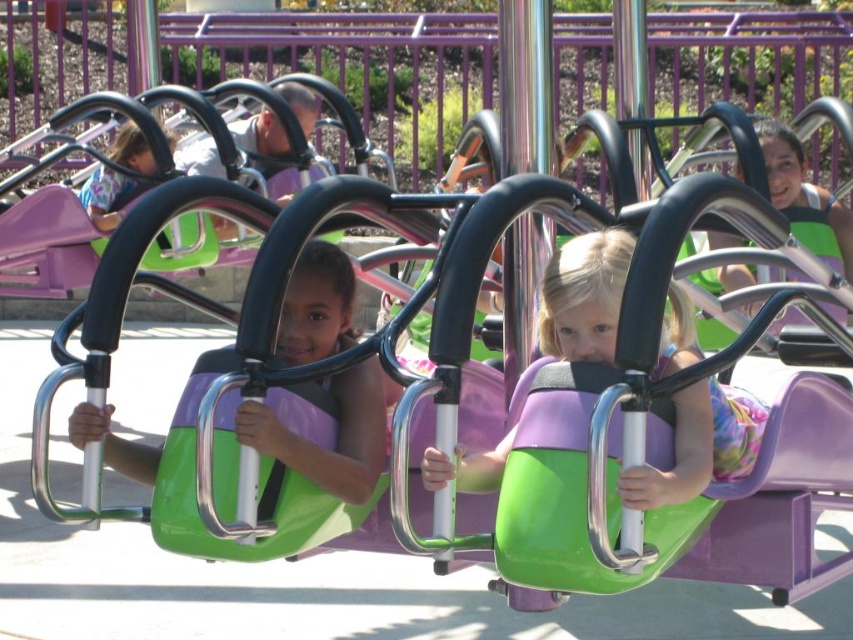
You are a safety inspector checking the theme park ride. You notice the matte green seat at center and the matte green helmet at center. According to safety regulations, the seat must be taller than the helmet to ensure proper headroom. Is there a potential safety issue with the current setup?

The matte green seat at center is not as tall as the matte green helmet at center, which means the seat is shorter than required. This could be a safety issue because the seat needs to be taller than the helmet to provide adequate headroom.

You are a ride inspector checking the safety distance between the matte green seat at center and the matte purple helmet at center. According to safety regulations, the minimum required distance is 5 feet. Is the current distance compliant with the safety standards?

The matte green seat at center is 4.85 feet from the matte purple helmet at center, which is less than the required 5 feet. Therefore, the current distance does not comply with safety standards.

From the picture: You are a ride inspector checking the carousel seats. The safety manual states that all seats must be positioned within the central safety zone defined by coordinates between 0.5 and 0.7 on the x and y axes. Is the matte green seat at center within this safety zone?

The matte green seat at center is located at point (337, 435). The y coordinate 0.396 is below the required 0.5, so it is outside the safety zone.